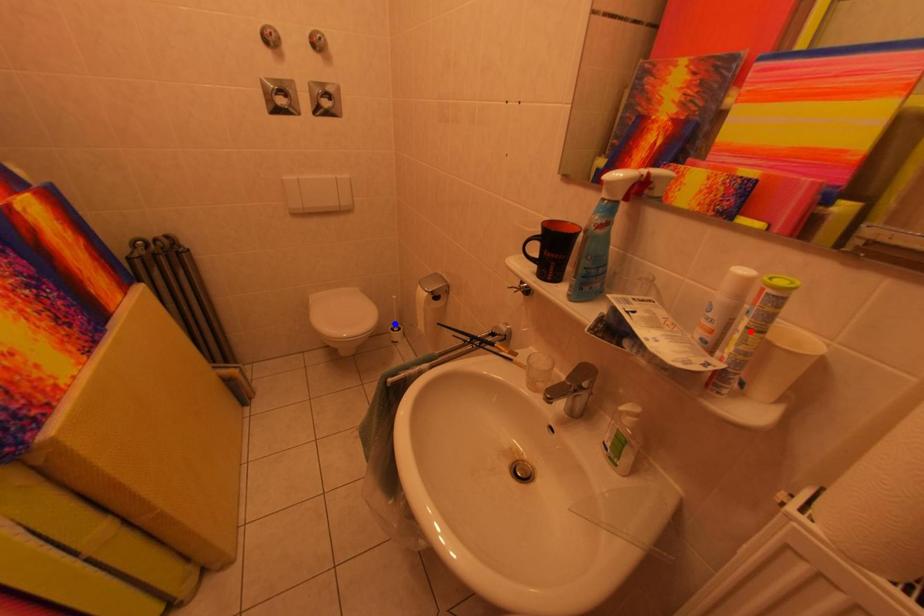
Question: Two points are marked on the image. Which point is closer to the camera?

Choices:
 (A) Blue point is closer.
 (B) Red point is closer.

Answer: (B)